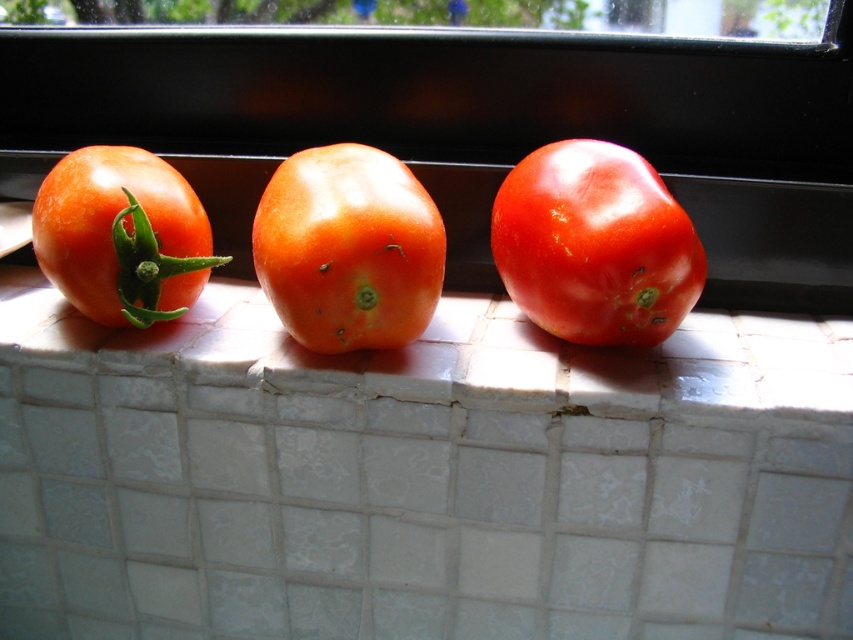
Question: Which is farther from the glossy matte tomato at left?

Choices:
 (A) glossy orange tomato at center
 (B) glossy red tomato at center

Answer: (B)

Question: Can you confirm if glossy red tomato at center is positioned to the right of glossy matte tomato at left?

Choices:
 (A) no
 (B) yes

Answer: (B)

Question: Is glossy red tomato at center further to camera compared to glossy orange tomato at center?

Choices:
 (A) yes
 (B) no

Answer: (A)

Question: Is glossy red tomato at center below glossy matte tomato at left?

Choices:
 (A) yes
 (B) no

Answer: (A)

Question: Based on their relative distances, which object is nearer to the glossy orange tomato at center?

Choices:
 (A) glossy red tomato at center
 (B) glossy matte tomato at left

Answer: (B)

Question: Which object is the farthest from the glossy orange tomato at center?

Choices:
 (A) glossy red tomato at center
 (B) glossy matte tomato at left

Answer: (A)